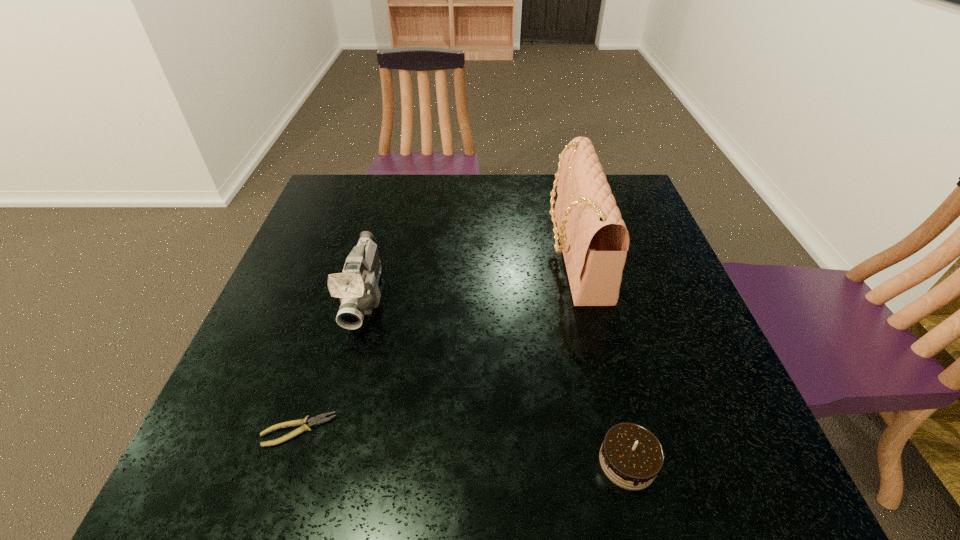
Find the location of a particular element. handbag is located at coordinates (594, 240).

You are a GUI agent. You are given a task and a screenshot of the screen. Output one action in this format:
    pyautogui.click(x=<x>, y=<y>)
    Task: Click on the third shortest object
    This screenshot has width=960, height=540.
    Given the screenshot: What is the action you would take?
    pyautogui.click(x=357, y=288)

Where is `the third tallest object`? the third tallest object is located at coordinates (631, 456).

This screenshot has width=960, height=540. I want to click on pliers, so click(318, 420).

The image size is (960, 540). I want to click on blank space located on the front-facing side of the handbag, so click(394, 254).

Locate an element on the screen. vacant space located 0.340m on the front-facing side of the handbag is located at coordinates (417, 254).

Image resolution: width=960 pixels, height=540 pixels. Find the location of `free space located 0.110m on the front-facing side of the handbag`. free space located 0.110m on the front-facing side of the handbag is located at coordinates (506, 254).

The image size is (960, 540). I want to click on free space located 0.180m on the front-facing side of the third shortest object, so click(x=335, y=411).

The width and height of the screenshot is (960, 540). I want to click on vacant space located on the back of the third tallest object, so click(x=585, y=288).

Find the location of `vacant point located on the right of the pliers`. vacant point located on the right of the pliers is located at coordinates (452, 430).